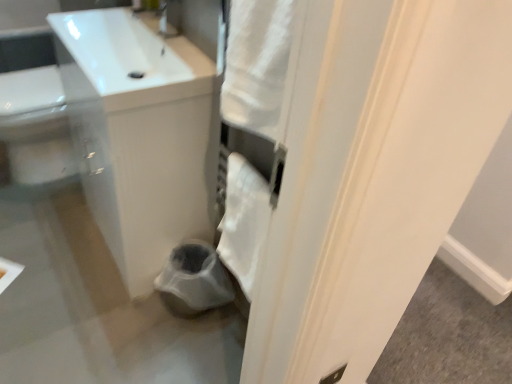
Question: Can white glossy sink at upper left be found inside white glossy sink at upper left?

Choices:
 (A) no
 (B) yes

Answer: (A)

Question: Does white glossy sink at upper left turn towards white glossy sink at upper left?

Choices:
 (A) yes
 (B) no

Answer: (B)

Question: Can you confirm if white glossy sink at upper left is thinner than white glossy sink at upper left?

Choices:
 (A) no
 (B) yes

Answer: (B)

Question: From the image's perspective, would you say white glossy sink at upper left is shown under white glossy sink at upper left?

Choices:
 (A) yes
 (B) no

Answer: (B)

Question: From a real-world perspective, is white glossy sink at upper left positioned over white glossy sink at upper left based on gravity?

Choices:
 (A) yes
 (B) no

Answer: (A)

Question: Is white glossy sink at upper left inside or outside of white soft towel at center?

Choices:
 (A) inside
 (B) outside

Answer: (B)

Question: Based on their sizes in the image, would you say white glossy sink at upper left is bigger or smaller than white soft towel at center?

Choices:
 (A) small
 (B) big

Answer: (B)

Question: Considering the positions of white glossy sink at upper left and white soft towel at center in the image, is white glossy sink at upper left wider or thinner than white soft towel at center?

Choices:
 (A) thin
 (B) wide

Answer: (B)

Question: Is white glossy sink at upper left to the left or to the right of white soft towel at center in the image?

Choices:
 (A) right
 (B) left

Answer: (B)

Question: From a real-world perspective, relative to white glossy sink at upper left, is white soft towel at center vertically above or below?

Choices:
 (A) above
 (B) below

Answer: (A)

Question: Visually, is white soft towel at center positioned to the left or to the right of white glossy sink at upper left?

Choices:
 (A) right
 (B) left

Answer: (A)

Question: From the image's perspective, is white soft towel at center above or below white glossy sink at upper left?

Choices:
 (A) above
 (B) below

Answer: (B)

Question: In terms of height, does white soft towel at center look taller or shorter compared to white glossy sink at upper left?

Choices:
 (A) short
 (B) tall

Answer: (A)

Question: Do you think white soft towel at center is within white glossy sink at upper left, or outside of it?

Choices:
 (A) inside
 (B) outside

Answer: (B)

Question: Considering the positions of point coord(225,228) and point coord(80,28), is point coord(225,228) closer or farther from the camera than point coord(80,28)?

Choices:
 (A) farther
 (B) closer

Answer: (B)